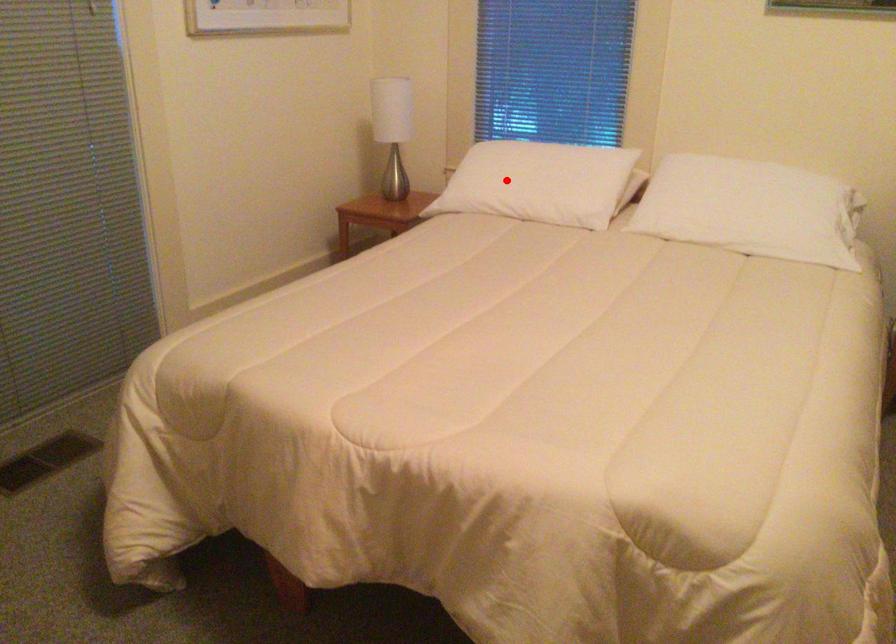
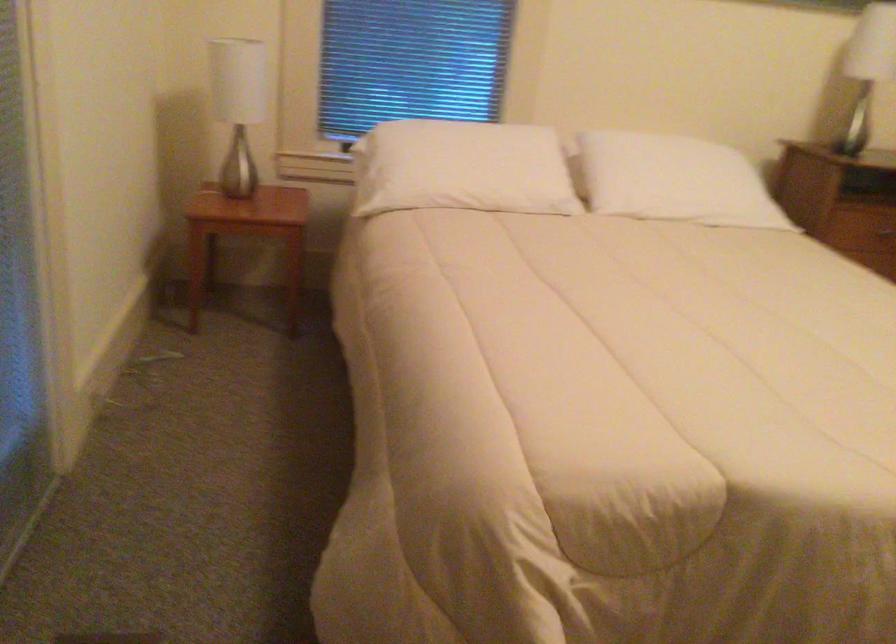
Question: A red point is marked in image1. In image2, is the corresponding 3D point closer to the camera or farther? Reply with the corresponding letter.

Choices:
 (A) The corresponding 3D point is closer.
 (B) The corresponding 3D point is farther.

Answer: (A)